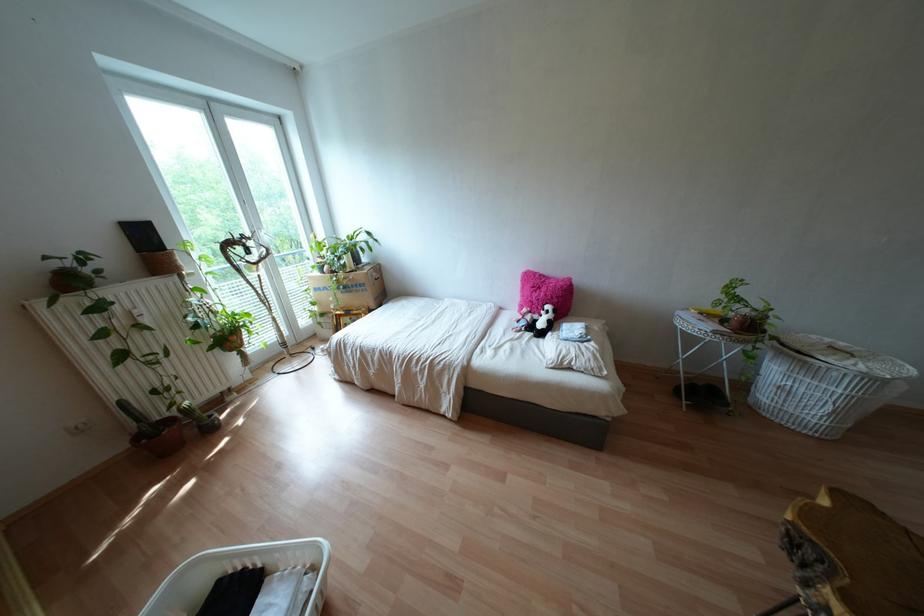
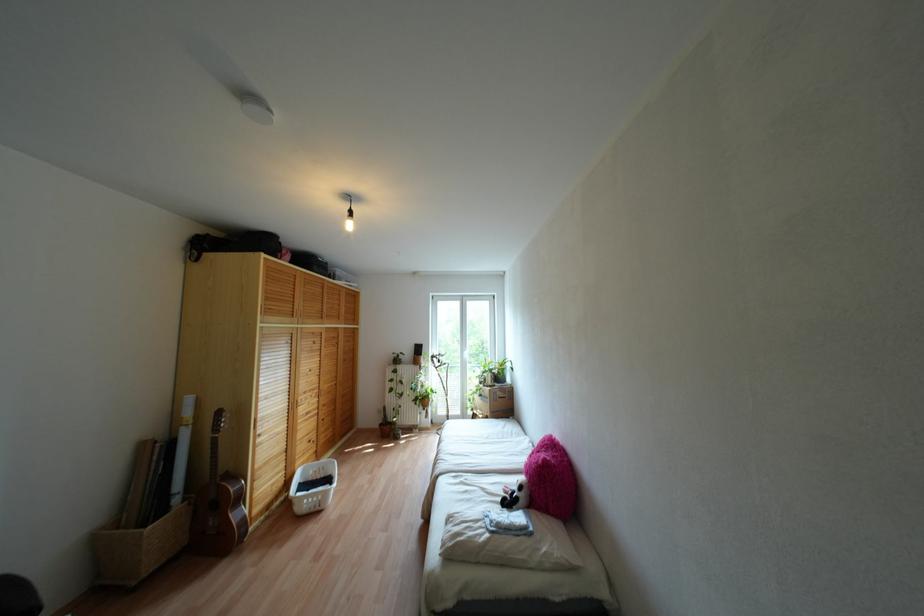
Where in the second image is the point corresponding to [337,312] from the first image?

(473, 411)